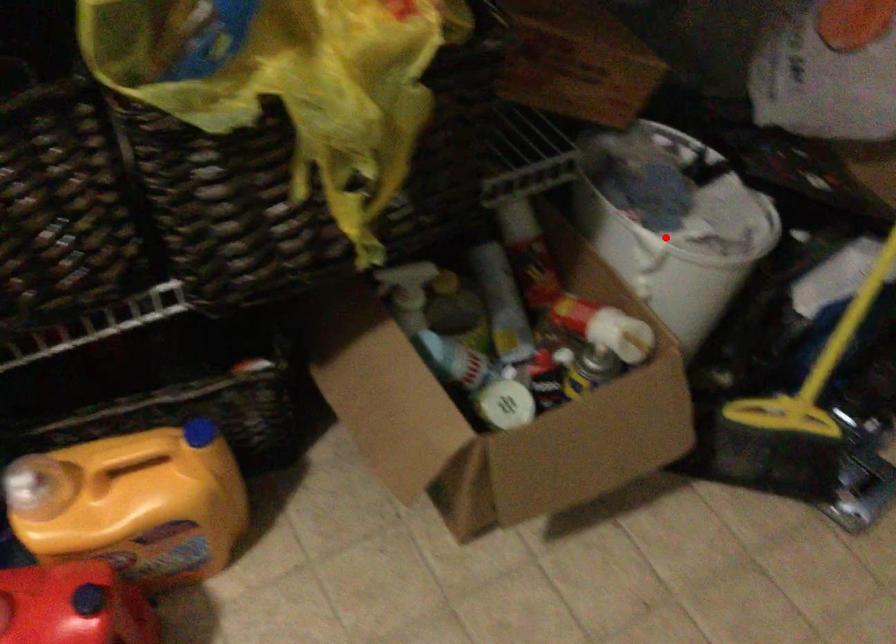
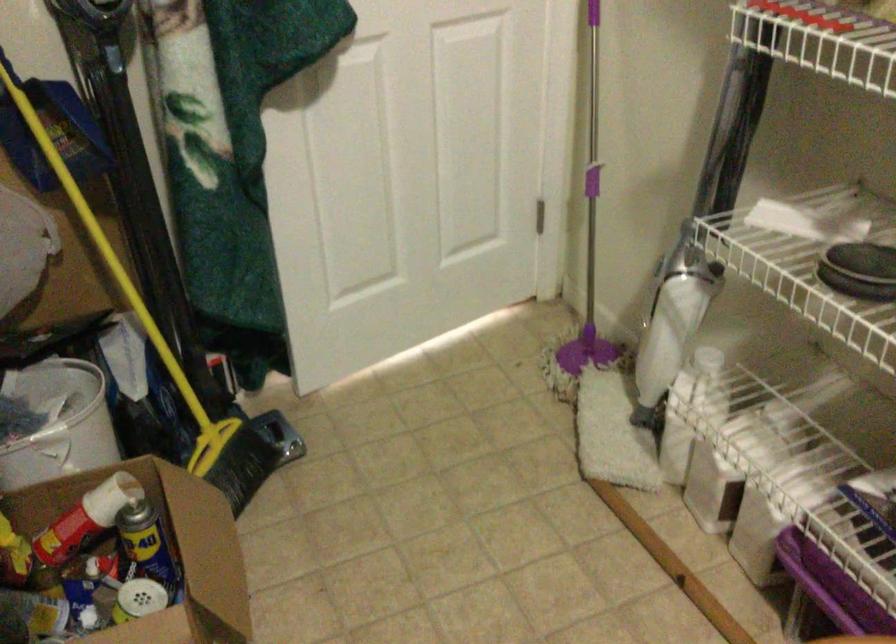
Question: I am providing you with two images of the same scene from different viewpoints. A red point is shown in image1. For the corresponding object point in image2, is it positioned nearer or farther from the camera?

Choices:
 (A) Nearer
 (B) Farther

Answer: (B)